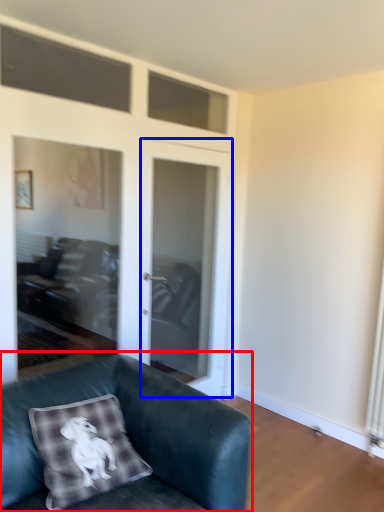
Question: Which of the following is the closest to the observer, studio couch (highlighted by a red box) or screen door (highlighted by a blue box)?

Choices:
 (A) studio couch
 (B) screen door

Answer: (A)